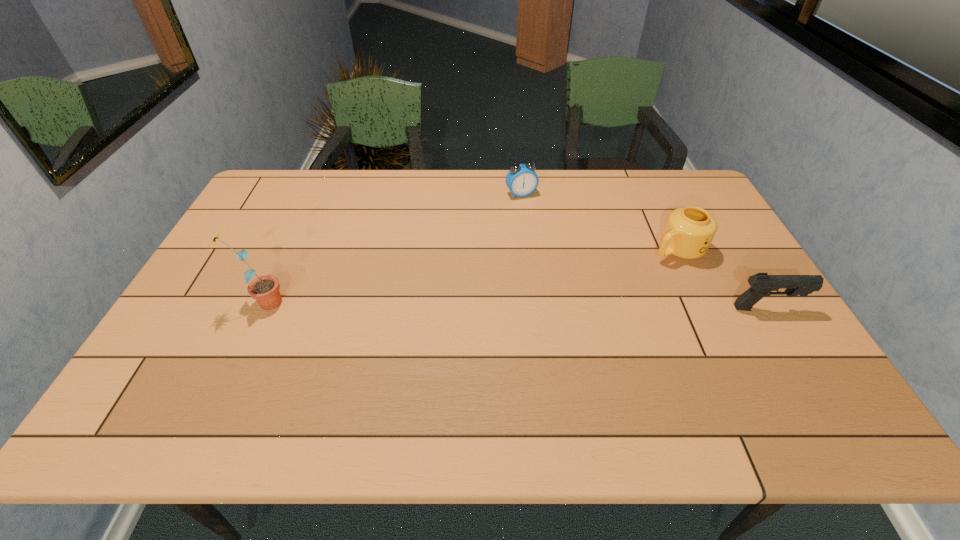
I want to click on vacant space located 0.290m on the face of the farthest object, so click(559, 255).

The image size is (960, 540). In order to click on free space located on the face of the farthest object in this screenshot , I will do `click(563, 261)`.

Locate an element on the screen. The height and width of the screenshot is (540, 960). free spot located 0.360m on the face of the farthest object is located at coordinates (568, 271).

Where is `object at the far edge`? Image resolution: width=960 pixels, height=540 pixels. object at the far edge is located at coordinates (521, 180).

Locate an element on the screen. object at the left edge is located at coordinates (265, 289).

Where is `pistol positioned at the right edge`? This screenshot has height=540, width=960. pistol positioned at the right edge is located at coordinates (762, 284).

Find the location of a particular element. mug positioned at the right edge is located at coordinates (689, 231).

Where is `free region at the far edge`? The width and height of the screenshot is (960, 540). free region at the far edge is located at coordinates (447, 173).

You are a GUI agent. You are given a task and a screenshot of the screen. Output one action in this format:
    pyautogui.click(x=<x>, y=<y>)
    Task: Click on the vacant space at the near edge of the desktop
    
    Given the screenshot: What is the action you would take?
    pyautogui.click(x=620, y=363)

This screenshot has width=960, height=540. Find the location of `vacant space at the left edge of the desktop`. vacant space at the left edge of the desktop is located at coordinates (207, 317).